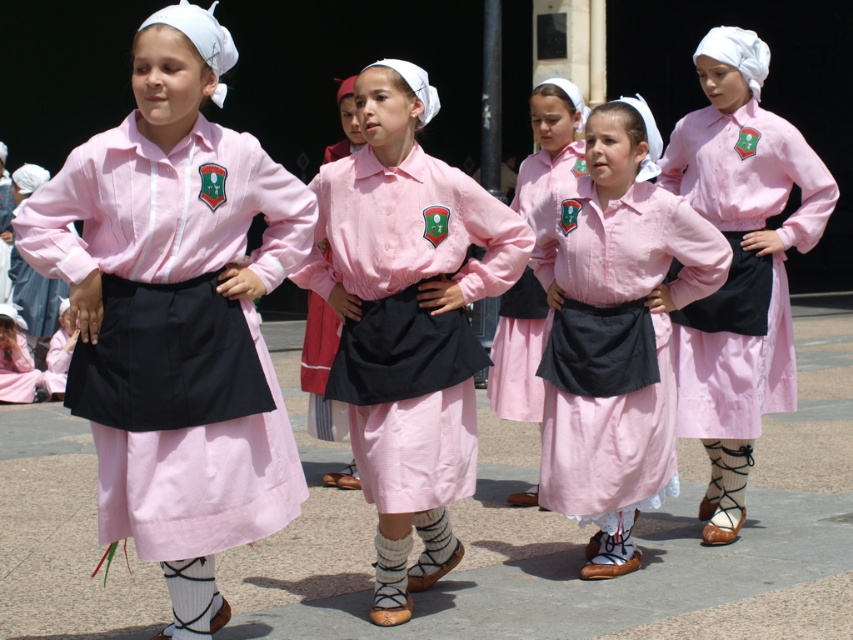
Is matte pink shirt at center bigger than pink cotton skirt at center?

Yes.

Is point (825, 176) behind point (471, 472)?

Yes, point (825, 176) is farther from viewer.

You are a GUI agent. You are given a task and a screenshot of the screen. Output one action in this format:
    pyautogui.click(x=<x>, y=<y>)
    Task: Click on the matte pink shirt at center
    
    Given the screenshot: What is the action you would take?
    pyautogui.click(x=740, y=262)

Is point (291, 180) more distant than point (590, 480)?

No, it is not.

Where is `pink cotton skirt at left`? This screenshot has height=640, width=853. pink cotton skirt at left is located at coordinates (165, 209).

Where is `pink cotton skirt at left`? pink cotton skirt at left is located at coordinates (165, 209).

Measure the distance from pink cotton skirt at left to pink cotton skirt at center.

They are 25.20 inches apart.

Between point (274, 198) and point (386, 381), which one is positioned behind?

Point (386, 381)

Find the location of `pink cotton skirt at left`. pink cotton skirt at left is located at coordinates (165, 209).